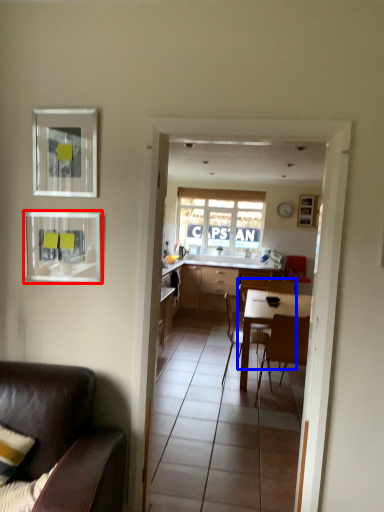
Question: Which of the following is the farthest to the observer, picture frame (highlighted by a red box) or chair (highlighted by a blue box)?

Choices:
 (A) picture frame
 (B) chair

Answer: (B)